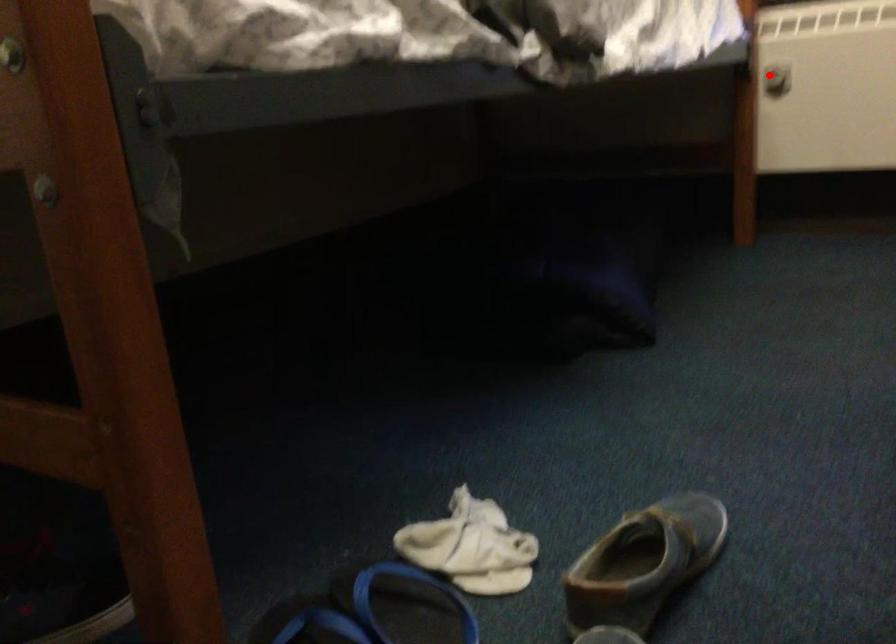
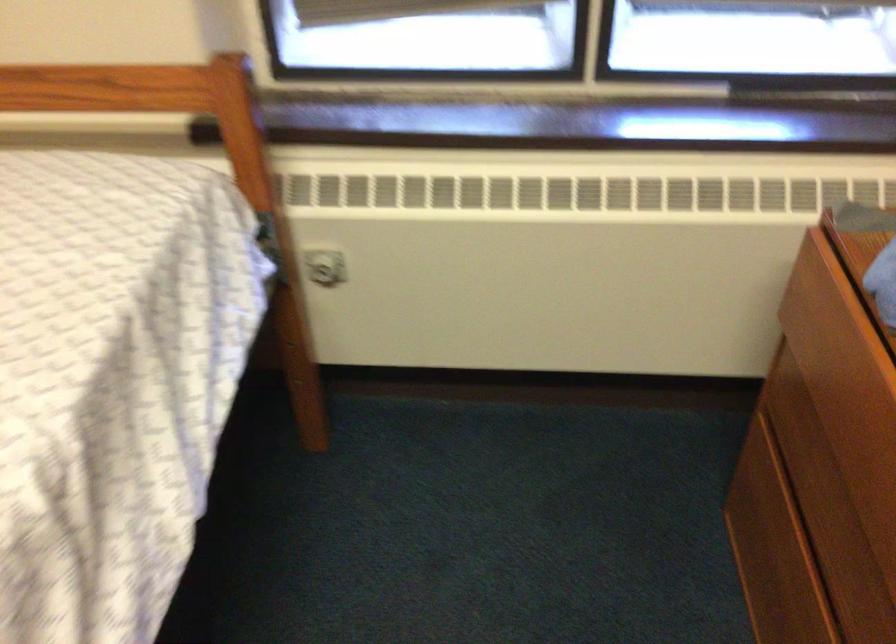
Question: I am providing you with two images of the same scene from different viewpoints. Given a red point in image1, look at the same physical point in image2. Is it:

Choices:
 (A) Closer to the viewpoint
 (B) Farther from the viewpoint

Answer: (A)